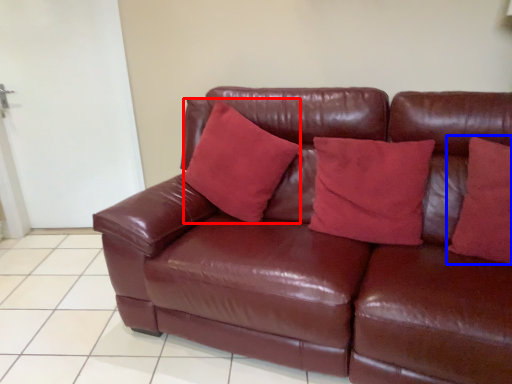
Question: Which object appears closest to the camera in this image, pillow (highlighted by a red box) or pillow (highlighted by a blue box)?

Choices:
 (A) pillow
 (B) pillow

Answer: (B)